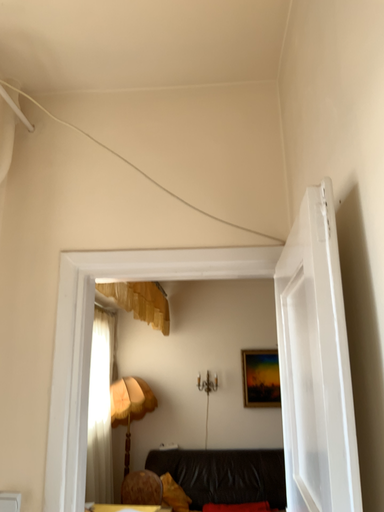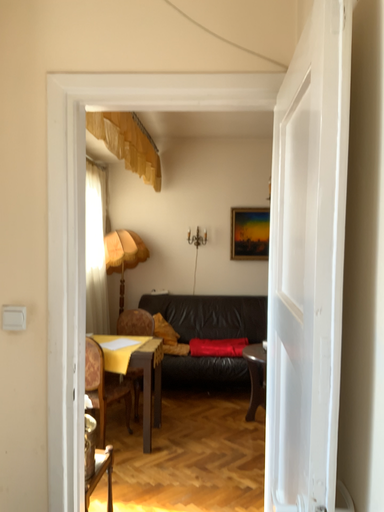
Question: How did the camera likely rotate when shooting the video?

Choices:
 (A) rotated downward
 (B) rotated upward

Answer: (A)